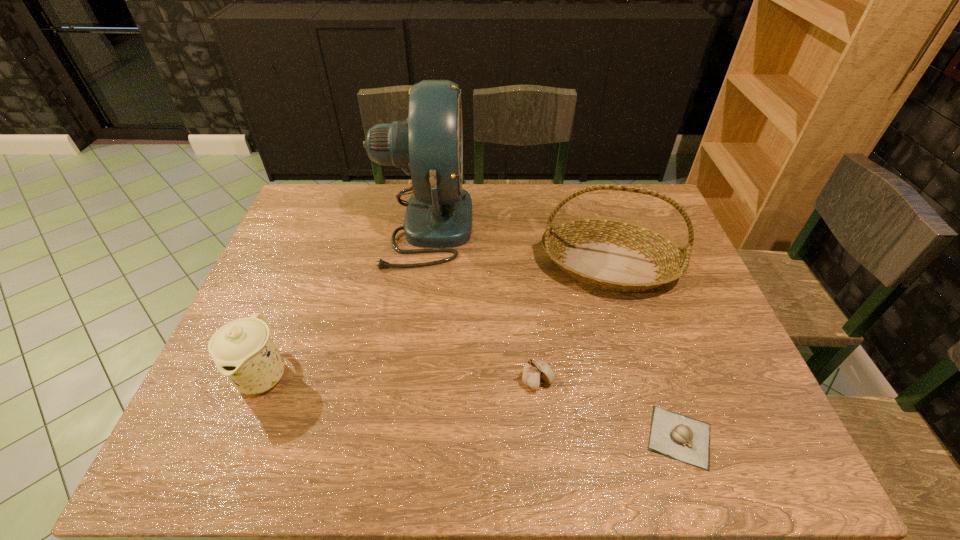
I want to click on empty space between the tallest object and the second shortest object, so click(x=481, y=303).

Locate an element on the screen. Image resolution: width=960 pixels, height=540 pixels. free space between the chinaware and the second tallest object is located at coordinates (437, 320).

Where is `free space between the basket and the left garlic`? This screenshot has height=540, width=960. free space between the basket and the left garlic is located at coordinates (573, 323).

Identify the location of vacant area between the fourth shortest object and the tallest object. (516, 245).

The width and height of the screenshot is (960, 540). What are the coordinates of `free space that is in between the nearer garlic and the leftmost object` in the screenshot? It's located at (471, 406).

The width and height of the screenshot is (960, 540). Identify the location of vacant area that lies between the third tallest object and the fourth tallest object. (400, 377).

Identify the location of vacant region between the second tallest object and the shorter garlic. [x=644, y=351].

This screenshot has height=540, width=960. Identify the location of object identified as the third closest to the nearer garlic. (428, 146).

The height and width of the screenshot is (540, 960). Identify the location of object that is the fourth closest to the farther garlic. (243, 350).

At what (x,y) coordinates should I click in order to perform the action: click on free point that satisfies the following two spatial constraints: 1. in front of the tallest object to blow air; 2. on the back side of the shortest object. Please return your answer as a coordinate pair (x, y). Image resolution: width=960 pixels, height=540 pixels. Looking at the image, I should click on (395, 437).